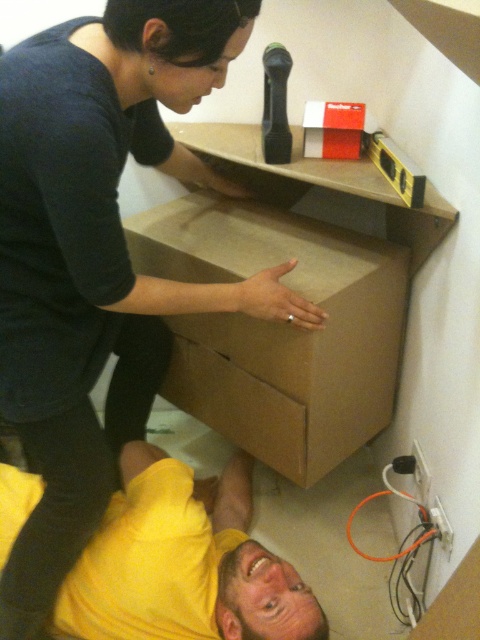
Does point (208, 579) come in front of point (181, 339)?

Yes, it is.

Is point (143, 636) farther from viewer compared to point (252, 417)?

That is False.

Find the location of a particular element. Image resolution: width=480 pixels, height=640 pixels. yellow matte shirt at lower left is located at coordinates (182, 564).

Does matte black shirt at upper left come in front of yellow matte shirt at lower left?

Yes.

Can you confirm if matte black shirt at upper left is positioned below yellow matte shirt at lower left?

No.

Who is more distant from viewer, [119,154] or [118,625]?

Point [118,625]

Locate an element on the screen. matte black shirt at upper left is located at coordinates (97, 257).

Who is taller, matte black shirt at upper left or brown matte drawer at center?

matte black shirt at upper left is taller.

Measure the distance between point (x=35, y=173) and camera.

A distance of 87.57 centimeters exists between point (x=35, y=173) and camera.

Is point (233, 49) in front of point (192, 342)?

Yes, point (233, 49) is in front of point (192, 342).

At what (x,y) coordinates should I click in order to perform the action: click on matte black shirt at upper left. Please return your answer as a coordinate pair (x, y). The image size is (480, 640). Looking at the image, I should click on (97, 257).